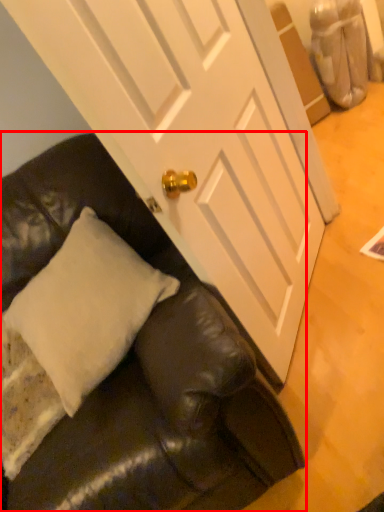
Question: From the image, what is the correct spatial relationship of studio couch (annotated by the red box) in relation to pillow?

Choices:
 (A) right
 (B) left

Answer: (A)